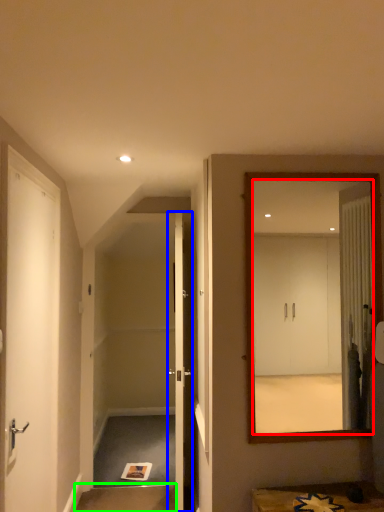
Question: Which object is the farthest from mirror (highlighted by a red box)? Choose among these: door (highlighted by a blue box) or stair (highlighted by a green box).

Choices:
 (A) door
 (B) stair

Answer: (B)